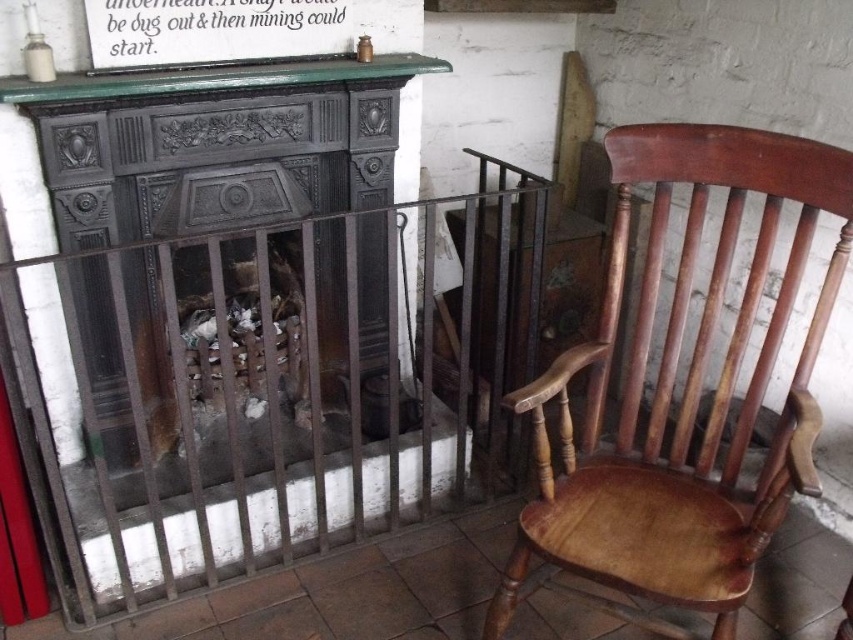
From the picture: Does wooden chair at right have a lesser height compared to green painted wood mantle at upper center?

No, wooden chair at right is not shorter than green painted wood mantle at upper center.

Between wooden chair at right and green painted wood mantle at upper center, which one is positioned higher?

green painted wood mantle at upper center is higher up.

Who is more forward, (722,145) or (39,83)?

Point (39,83) is more forward.

Locate an element on the screen. The width and height of the screenshot is (853, 640). wooden chair at right is located at coordinates (683, 385).

Is dark gray cast iron fireplace at center further to the viewer compared to green painted wood mantle at upper center?

No.

Between dark gray cast iron fireplace at center and green painted wood mantle at upper center, which one is positioned higher?

green painted wood mantle at upper center is above.

Between point (115, 228) and point (389, 74), which one is positioned behind?

The point (389, 74) is more distant.

Find the location of a particular element. The width and height of the screenshot is (853, 640). dark gray cast iron fireplace at center is located at coordinates (219, 323).

Which is above, dark gray cast iron fireplace at center or wooden chair at right?

Positioned higher is dark gray cast iron fireplace at center.

Describe the element at coordinates (219, 323) in the screenshot. I see `dark gray cast iron fireplace at center` at that location.

I want to click on dark gray cast iron fireplace at center, so click(x=219, y=323).